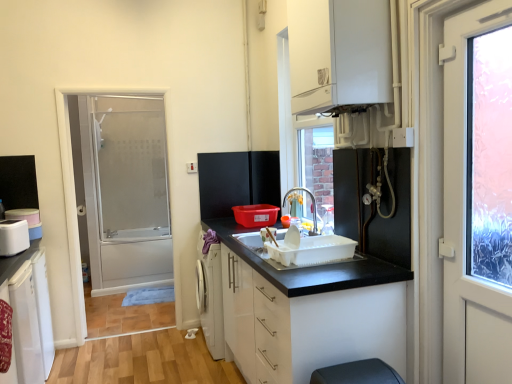
Identify the location of matte silver faucet at upper center. Image resolution: width=512 pixels, height=384 pixels. (312, 206).

Image resolution: width=512 pixels, height=384 pixels. Describe the element at coordinates (312, 206) in the screenshot. I see `matte silver faucet at upper center` at that location.

What is the approximate width of black matte refrigerator at center, which is the 1th appliance in top-to-bottom order?

It is 1.90 inches.

What is the approximate height of white matte refrigerator at lower left, arranged as the third cabinetry when viewed from the right?

The height of white matte refrigerator at lower left, arranged as the third cabinetry when viewed from the right, is 36.59 inches.

What is the approximate height of white matte door at right?

5.48 feet.

What do you see at coordinates (126, 192) in the screenshot?
I see `frosted glass shower door at left` at bounding box center [126, 192].

Identify the location of white glossy cabinet at upper center, the first cabinetry viewed from the top. This screenshot has width=512, height=384. (339, 53).

The image size is (512, 384). I want to click on matte silver faucet at upper center, so click(x=312, y=206).

Is white matte door at right taller or shorter than white matte cabinet at center, which is the 2th cabinetry from left to right?

white matte door at right is taller than white matte cabinet at center, which is the 2th cabinetry from left to right.

From the image's perspective, is white matte door at right located above or below white matte cabinet at center, which is counted as the second cabinetry, starting from the bottom?

Clearly, from the image's perspective, white matte door at right is above white matte cabinet at center, which is counted as the second cabinetry, starting from the bottom.

Considering the points (466, 352) and (269, 268), which point is behind, point (466, 352) or point (269, 268)?

The point (269, 268) is farther from the camera.

Would you say white matte refrigerator at lower left, which ranks as the 3th cabinetry in top-to-bottom order, contains white glossy cabinet at upper center, the first cabinetry viewed from the top?

That's incorrect, white glossy cabinet at upper center, the first cabinetry viewed from the top, is not inside white matte refrigerator at lower left, which ranks as the 3th cabinetry in top-to-bottom order.

Does white matte refrigerator at lower left, acting as the first cabinetry starting from the left, turn towards white glossy cabinet at upper center, marked as the 3th cabinetry in a bottom-to-top arrangement?

No.

How different are the orientations of white matte refrigerator at lower left, acting as the first cabinetry starting from the left, and white glossy cabinet at upper center, the first cabinetry viewed from the right, in degrees?

178 degrees separate the facing orientations of white matte refrigerator at lower left, acting as the first cabinetry starting from the left, and white glossy cabinet at upper center, the first cabinetry viewed from the right.

Considering the sizes of white matte refrigerator at lower left, acting as the first cabinetry starting from the left, and white glossy cabinet at upper center, the first cabinetry viewed from the top, in the image, is white matte refrigerator at lower left, acting as the first cabinetry starting from the left, taller or shorter than white glossy cabinet at upper center, the first cabinetry viewed from the top,?

In the image, white matte refrigerator at lower left, acting as the first cabinetry starting from the left, appears to be taller than white glossy cabinet at upper center, the first cabinetry viewed from the top.

Is point (12, 251) less distant than point (360, 272)?

No, (12, 251) is behind (360, 272).

From a real-world perspective, is white plastic container at left, positioned as the second appliance in back-to-front order, positioned under white matte cabinet at center, which is counted as the second cabinetry, starting from the bottom, based on gravity?

No, from a real-world perspective, white plastic container at left, positioned as the second appliance in back-to-front order, is not below white matte cabinet at center, which is counted as the second cabinetry, starting from the bottom.

Is white plastic container at left, positioned as the second appliance in back-to-front order, located outside white matte cabinet at center, which is the 2th cabinetry from left to right?

Yes, white plastic container at left, positioned as the second appliance in back-to-front order, is outside of white matte cabinet at center, which is the 2th cabinetry from left to right.

From the picture: Is white plastic container at left, which is the 2th appliance in top-to-bottom order, behind white matte cabinet at center, positioned as the second cabinetry in right-to-left order?

Yes, white plastic container at left, which is the 2th appliance in top-to-bottom order, is behind white matte cabinet at center, positioned as the second cabinetry in right-to-left order.

Is white glossy cabinet at upper center, the first cabinetry viewed from the top, aimed at matte silver faucet at upper center?

No, white glossy cabinet at upper center, the first cabinetry viewed from the top, is not aimed at matte silver faucet at upper center.

Measure the distance between white glossy cabinet at upper center, which is the third cabinetry from left to right, and matte silver faucet at upper center.

A distance of 1.54 meters exists between white glossy cabinet at upper center, which is the third cabinetry from left to right, and matte silver faucet at upper center.

Which of these two, white glossy cabinet at upper center, which is the third cabinetry from left to right, or matte silver faucet at upper center, is thinner?

matte silver faucet at upper center.

Based on the photo, from a real-world perspective, between white glossy cabinet at upper center, marked as the 3th cabinetry in a bottom-to-top arrangement, and matte silver faucet at upper center, who is vertically higher?

white glossy cabinet at upper center, marked as the 3th cabinetry in a bottom-to-top arrangement, is physically above.

Does point (14, 317) lie behind point (255, 277)?

Yes, point (14, 317) is farther from viewer.

Is white matte refrigerator at lower left, which ranks as the 3th cabinetry in top-to-bottom order, not close to white matte cabinet at center, positioned as the second cabinetry in right-to-left order?

Yes, white matte refrigerator at lower left, which ranks as the 3th cabinetry in top-to-bottom order, and white matte cabinet at center, positioned as the second cabinetry in right-to-left order, are quite far apart.

From the image's perspective, is white matte refrigerator at lower left, acting as the first cabinetry starting from the left, beneath white matte cabinet at center, positioned as the second cabinetry in right-to-left order?

Indeed, from the image's perspective, white matte refrigerator at lower left, acting as the first cabinetry starting from the left, is shown beneath white matte cabinet at center, positioned as the second cabinetry in right-to-left order.

From the picture: Is white matte refrigerator at lower left, which ranks as the 3th cabinetry in top-to-bottom order, facing away from white matte cabinet at center, positioned as the second cabinetry in right-to-left order?

white matte refrigerator at lower left, which ranks as the 3th cabinetry in top-to-bottom order, does not have its back to white matte cabinet at center, positioned as the second cabinetry in right-to-left order.

Could you tell me if white matte refrigerator at lower left, which is counted as the 1th cabinetry, starting from the bottom, is turned towards white plastic container at left, the 2th appliance in the right-to-left sequence?

No, white matte refrigerator at lower left, which is counted as the 1th cabinetry, starting from the bottom, is not facing towards white plastic container at left, the 2th appliance in the right-to-left sequence.

Does white matte refrigerator at lower left, which is counted as the 1th cabinetry, starting from the bottom, touch white plastic container at left, arranged as the first appliance when viewed from the front?

No, white matte refrigerator at lower left, which is counted as the 1th cabinetry, starting from the bottom, is not making contact with white plastic container at left, arranged as the first appliance when viewed from the front.

From a real-world perspective, is white matte refrigerator at lower left, arranged as the third cabinetry when viewed from the right, located beneath white plastic container at left, which is the 2th appliance in top-to-bottom order?

Correct, in the physical world, white matte refrigerator at lower left, arranged as the third cabinetry when viewed from the right, is lower than white plastic container at left, which is the 2th appliance in top-to-bottom order.

How different are the orientations of white plastic container at left, arranged as the first appliance when viewed from the front, and matte silver faucet at upper center in degrees?

They differ by 155 degrees in their facing directions.

From the image's perspective, does white plastic container at left, acting as the first appliance starting from the bottom, appear higher than matte silver faucet at upper center?

No.

Which of these two, white plastic container at left, acting as the first appliance starting from the bottom, or matte silver faucet at upper center, is smaller?

matte silver faucet at upper center is smaller.

Which is correct: white plastic container at left, the 2th appliance in the right-to-left sequence, is inside matte silver faucet at upper center, or outside of it?

white plastic container at left, the 2th appliance in the right-to-left sequence, is located beyond the bounds of matte silver faucet at upper center.

Locate an element on the screen. Image resolution: width=512 pixels, height=384 pixels. the 2nd cabinetry to the left of the white matte door at right, counting from the anchor's position is located at coordinates (311, 312).

The image size is (512, 384). What are the coordinates of `the 2nd cabinetry located beneath the white glossy cabinet at upper center, which is the third cabinetry from left to right (from a real-world perspective)` in the screenshot? It's located at (29, 312).

From the image, which object appears to be nearer to white plastic container at left, which is the 2th appliance in top-to-bottom order, white matte cabinet at center, positioned as the second cabinetry in right-to-left order, or white matte door at right?

The object closer to white plastic container at left, which is the 2th appliance in top-to-bottom order, is white matte cabinet at center, positioned as the second cabinetry in right-to-left order.

Based on their spatial positions, is white matte refrigerator at lower left, which ranks as the 3th cabinetry in top-to-bottom order, or black matte refrigerator at center, marked as the second appliance in a front-to-back arrangement, further from frosted glass shower door at left?

white matte refrigerator at lower left, which ranks as the 3th cabinetry in top-to-bottom order, is further to frosted glass shower door at left.

From the image, which object appears to be farther from matte silver faucet at upper center, black matte refrigerator at center, marked as the second appliance in a front-to-back arrangement, or white plastic container at left, which is the 2th appliance in top-to-bottom order?

Based on the image, white plastic container at left, which is the 2th appliance in top-to-bottom order, appears to be further to matte silver faucet at upper center.

Based on their spatial positions, is white matte door at right or matte silver faucet at upper center closer to frosted glass shower door at left?

The object closer to frosted glass shower door at left is matte silver faucet at upper center.

When comparing their distances from white matte door at right, does white plastic container at left, positioned as the second appliance in back-to-front order, or white glossy cabinet at upper center, which is the third cabinetry from left to right, seem further?

Based on the image, white plastic container at left, positioned as the second appliance in back-to-front order, appears to be further to white matte door at right.

Considering their positions, is frosted glass shower door at left positioned further to white glossy cabinet at upper center, the first cabinetry viewed from the top, than white matte cabinet at center, which is the 2th cabinetry from left to right?

frosted glass shower door at left.

Based on their spatial positions, is frosted glass shower door at left or black matte refrigerator at center, marked as the second appliance in a front-to-back arrangement, closer to white matte refrigerator at lower left, acting as the first cabinetry starting from the left?

The object closer to white matte refrigerator at lower left, acting as the first cabinetry starting from the left, is black matte refrigerator at center, marked as the second appliance in a front-to-back arrangement.

Looking at the image, which one is located closer to frosted glass shower door at left, matte silver faucet at upper center or white matte cabinet at center, the 2th cabinetry when ordered from top to bottom?

matte silver faucet at upper center is closer to frosted glass shower door at left.

Locate an element on the screen. screen door between white matte door at right and black matte refrigerator at center, which appears as the first appliance when viewed from the back, from front to back is located at coordinates (126, 192).

Image resolution: width=512 pixels, height=384 pixels. In order to click on tap located between white matte refrigerator at lower left, arranged as the third cabinetry when viewed from the right, and white matte door at right in the left-right direction in this screenshot , I will do `click(312, 206)`.

Locate an element on the screen. This screenshot has height=384, width=512. appliance between white matte refrigerator at lower left, acting as the first cabinetry starting from the left, and black matte refrigerator at center, which appears as the first appliance when viewed from the back, from left to right is located at coordinates (13, 237).

Locate an element on the screen. This screenshot has height=384, width=512. screen door situated between white matte refrigerator at lower left, which is counted as the 1th cabinetry, starting from the bottom, and matte silver faucet at upper center from left to right is located at coordinates (126, 192).